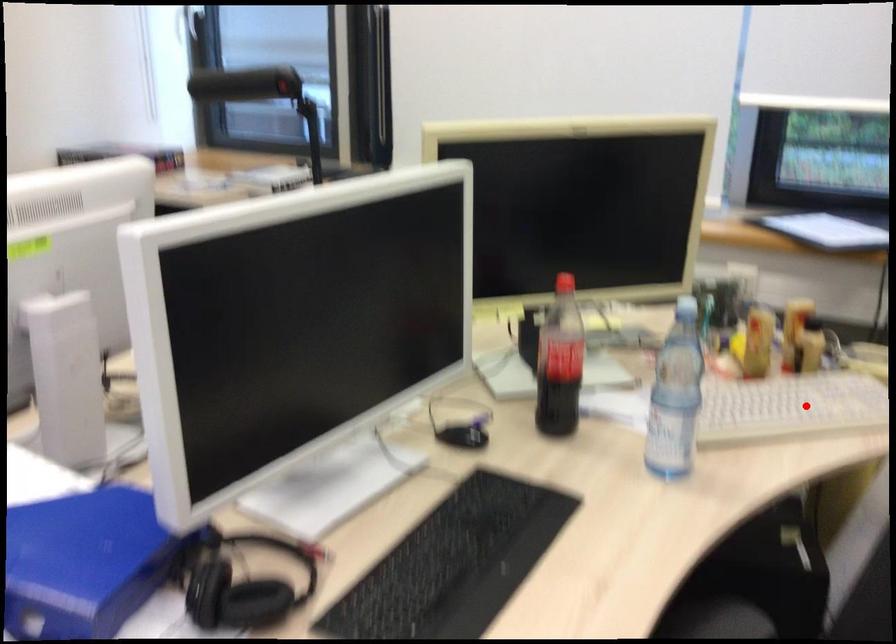
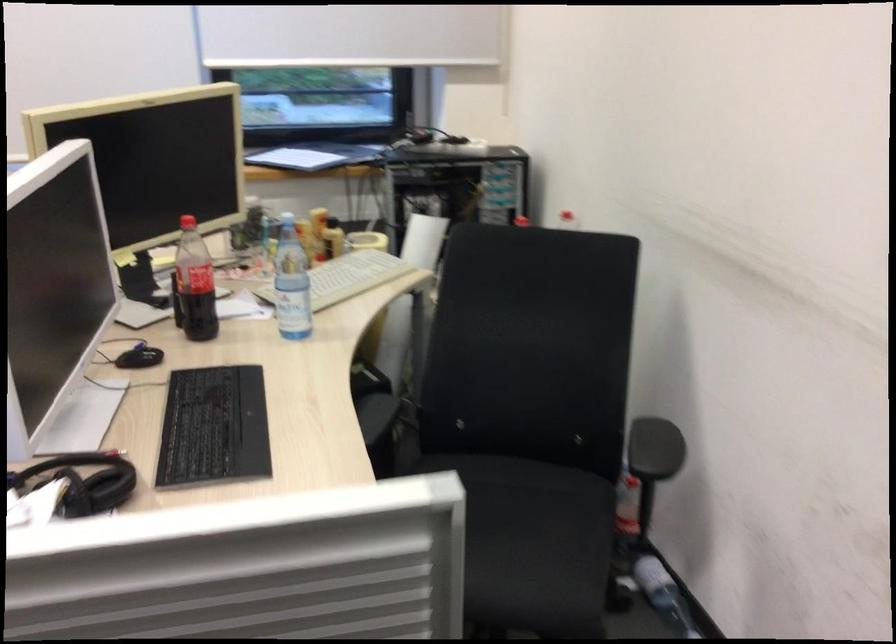
Question: I am providing you with two images of the same scene from different viewpoints. Image1 has a red point marked. In image2, the corresponding 3D location appears at what relative position? Reply with the corresponding letter.

Choices:
 (A) Closer
 (B) Farther

Answer: (B)